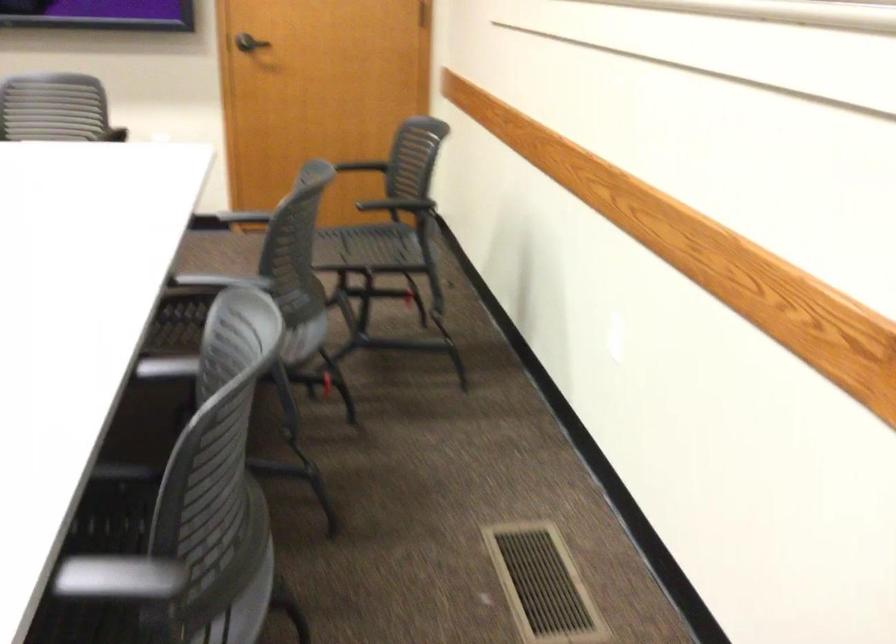
Locate an element on the screen. black door handle is located at coordinates (250, 43).